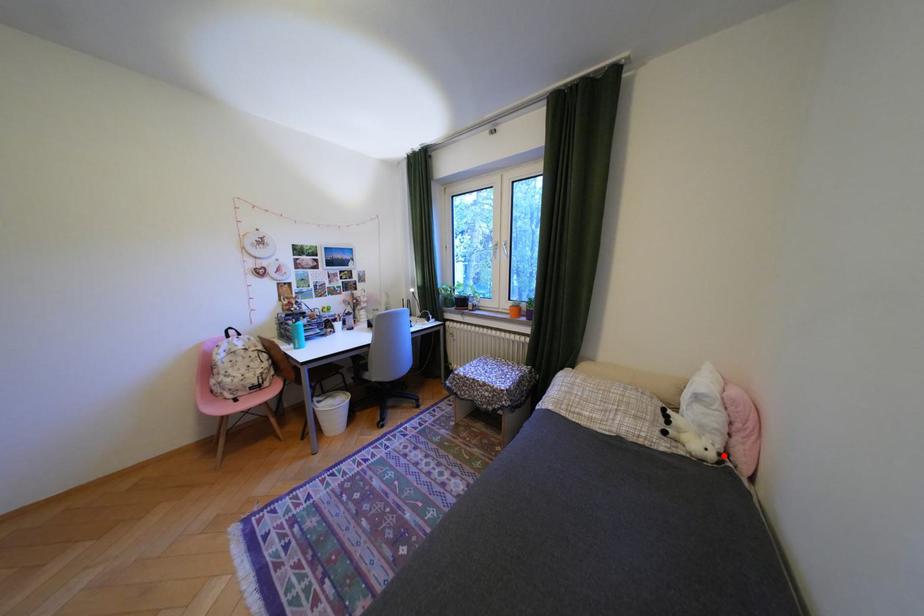
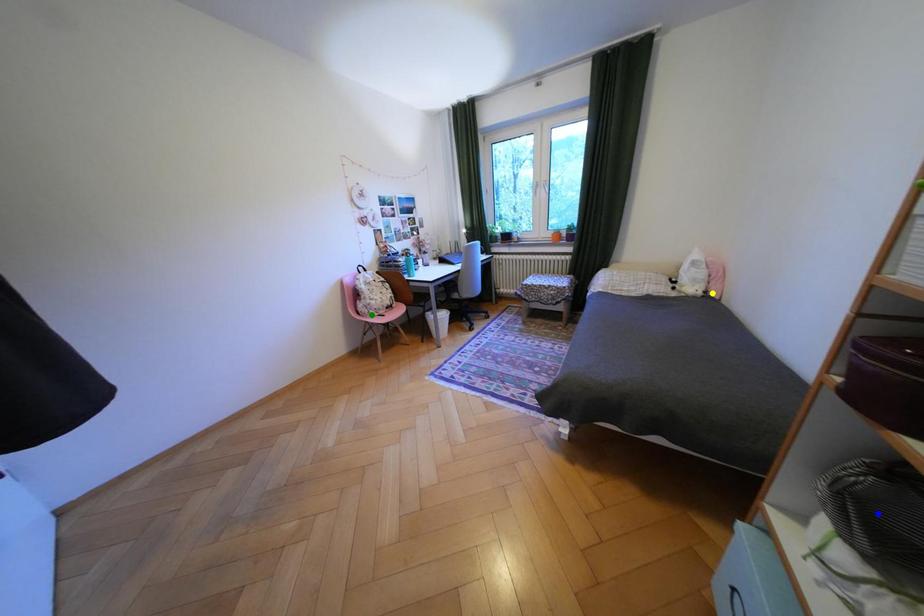
Question: I am providing you with two images of the same scene from different viewpoints. A red point is marked on the first image. You are given multiple points on the second image. Can you choose the point in image 2 that corresponds to the point in image 1?

Choices:
 (A) green point
 (B) yellow point
 (C) blue point

Answer: (B)